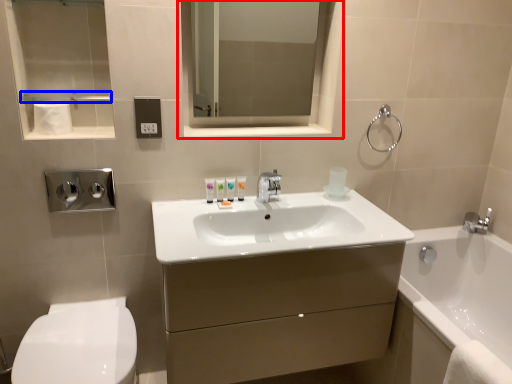
Question: Which object appears closest to the camera in this image, medicine cabinet (highlighted by a red box) or balustrade (highlighted by a blue box)?

Choices:
 (A) medicine cabinet
 (B) balustrade

Answer: (B)